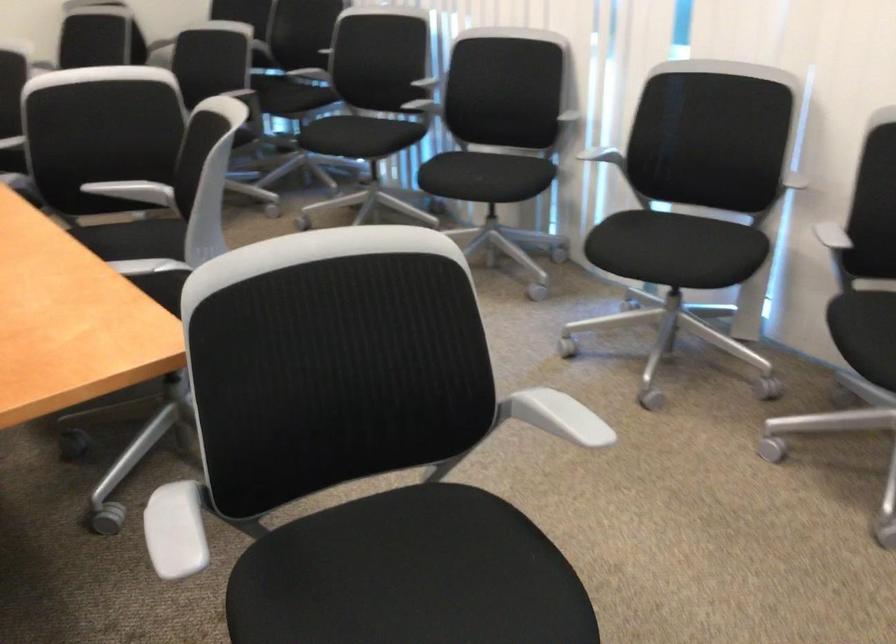
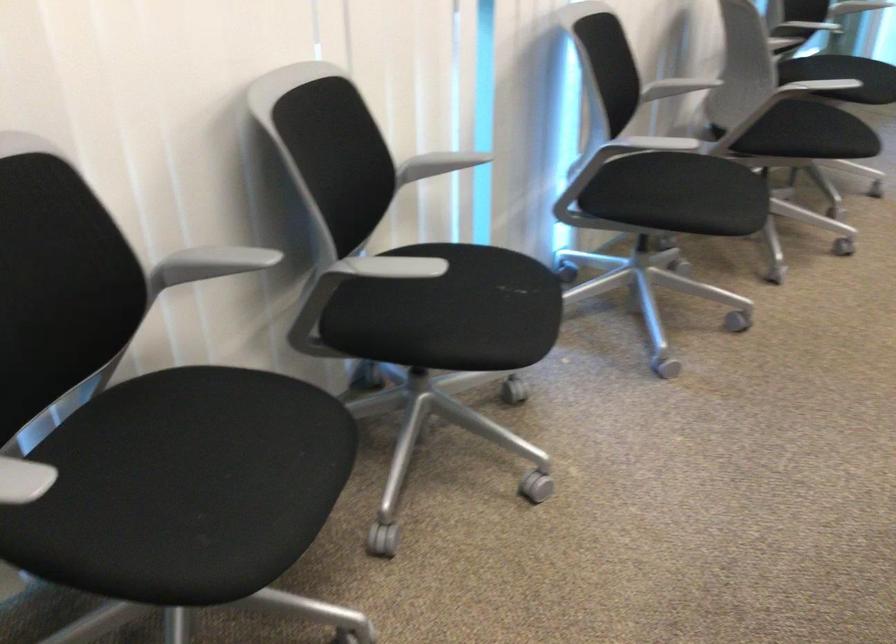
Find the pixel in the second image that matches pixel 416 108 in the first image.

(384, 267)